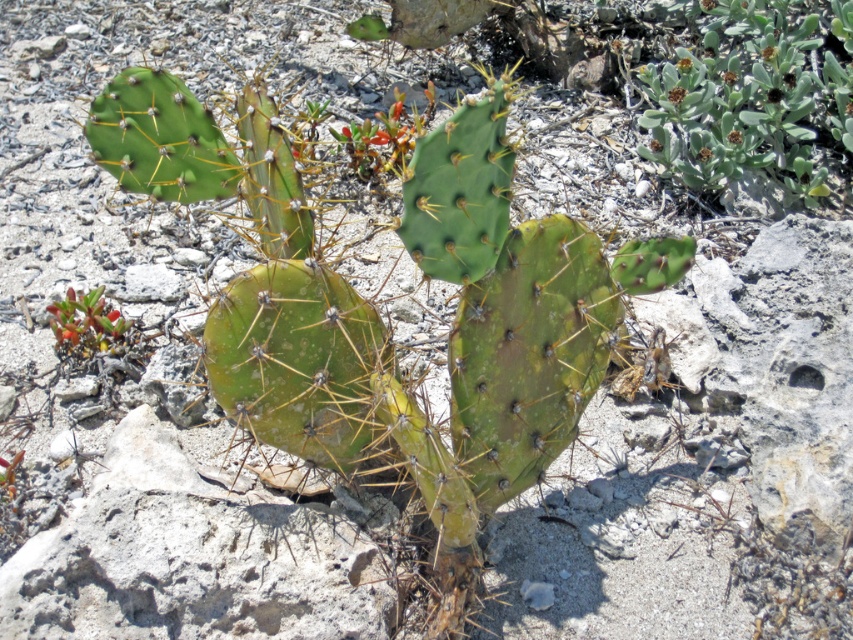
Question: Which point is farther from the camera taking this photo?

Choices:
 (A) (415, 129)
 (B) (337, 410)
 (C) (722, 100)
 (D) (102, 342)

Answer: (C)

Question: Which point is farther from the camera taking this photo?

Choices:
 (A) click(788, 195)
 (B) click(71, 304)
 (C) click(352, 147)

Answer: (C)

Question: Can you confirm if green spiny cactus at center is thinner than green succulent at lower left?

Choices:
 (A) no
 (B) yes

Answer: (A)

Question: Can you confirm if green spiny cactus at center is positioned below green fuzzy plant at upper right?

Choices:
 (A) yes
 (B) no

Answer: (A)

Question: Which of the following is the closest to the observer?

Choices:
 (A) (376, 172)
 (B) (84, 314)
 (C) (490, 124)

Answer: (C)

Question: Where is green fuzzy plant at upper right located in relation to green succulent at lower left in the image?

Choices:
 (A) left
 (B) right

Answer: (B)